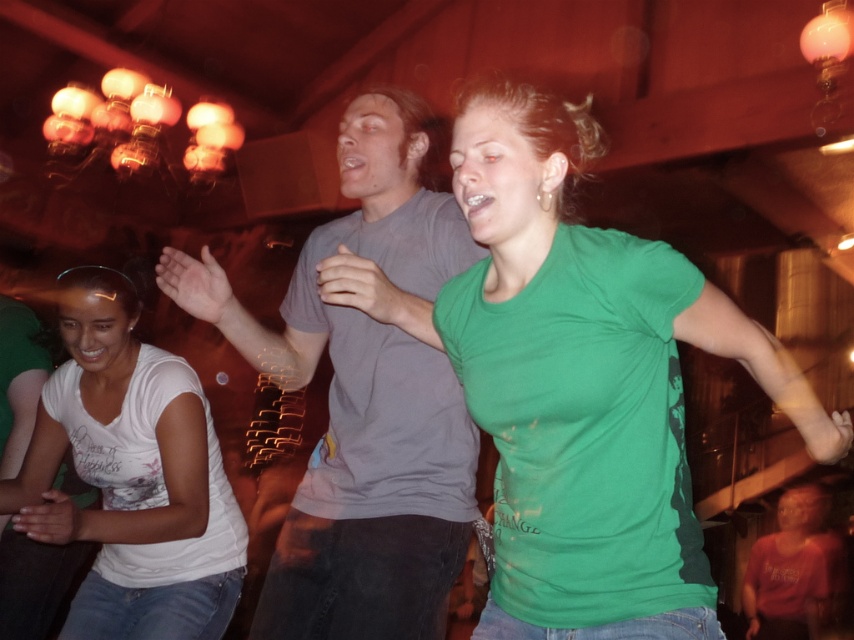
You are a photographer trying to capture the dancer in the gray matte t shirt at center. You notice a bright light source at point (363, 401). Where should you position the light source to ensure it illuminates the dancer properly?

The point (363, 401) is on the gray matte t shirt at center, so positioning the light source there would directly illuminate the dancer in the gray matte t shirt at center effectively.